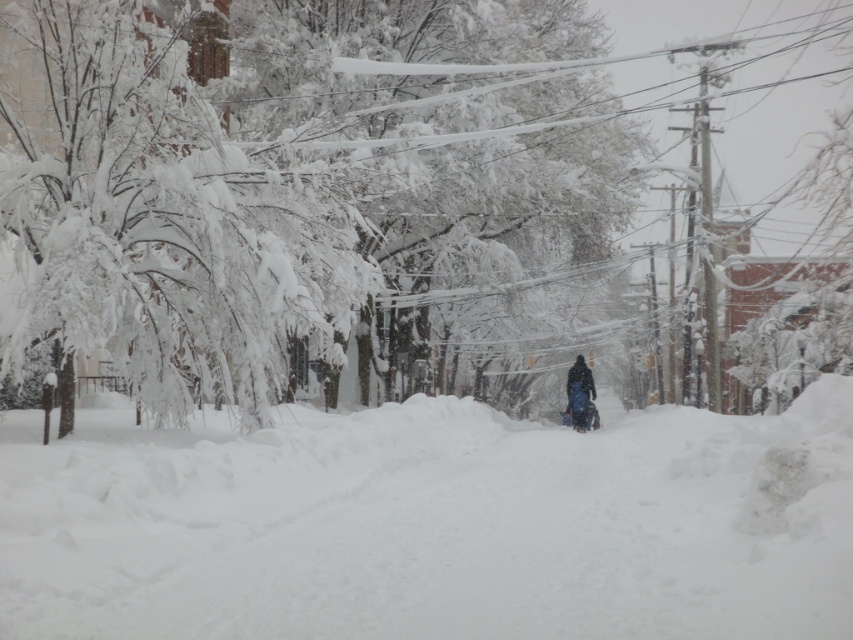
Question: Is white fluffy snow at center thinner than white frosty tree at center?

Choices:
 (A) yes
 (B) no

Answer: (B)

Question: Is white fluffy snow at center positioned in front of dark blue fabric at center?

Choices:
 (A) no
 (B) yes

Answer: (B)

Question: Which object appears closest to the camera in this image?

Choices:
 (A) white fluffy snow at center
 (B) dark blue fabric at center
 (C) white frosty tree at center

Answer: (A)

Question: Can you confirm if white frosty tree at center is bigger than dark blue fabric at center?

Choices:
 (A) no
 (B) yes

Answer: (B)

Question: Which point is closer to the camera?

Choices:
 (A) (109, 579)
 (B) (573, 408)

Answer: (A)

Question: Which of the following is the closest to the observer?

Choices:
 (A) white fluffy snow at center
 (B) dark blue fabric at center

Answer: (A)